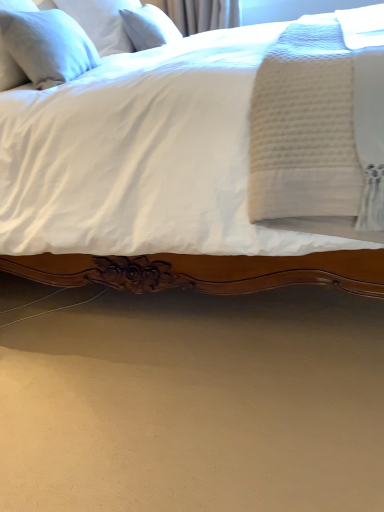
Question: Is white soft pillow at upper left, which is counted as the third pillow, starting from the front, taller or shorter than white linen pillow at upper left, the third pillow viewed from the back?

Choices:
 (A) short
 (B) tall

Answer: (A)

Question: In the image, is white soft pillow at upper left, which is counted as the third pillow, starting from the front, positioned in front of or behind white linen pillow at upper left, placed as the first pillow when sorted from front to back?

Choices:
 (A) behind
 (B) front

Answer: (A)

Question: Estimate the real-world distances between objects in this image. Which object is farther from the white soft pillow at upper left, the 1th pillow when ordered from back to front?

Choices:
 (A) white linen pillow at upper left, placed as the first pillow when sorted from front to back
 (B) white soft pillow at upper left, which is the 2th pillow from back to front

Answer: (A)

Question: Which of these objects is positioned closest to the white soft pillow at upper left, marked as the second pillow in a front-to-back arrangement?

Choices:
 (A) white linen pillow at upper left, placed as the first pillow when sorted from front to back
 (B) white soft pillow at upper left, which is counted as the third pillow, starting from the front

Answer: (B)